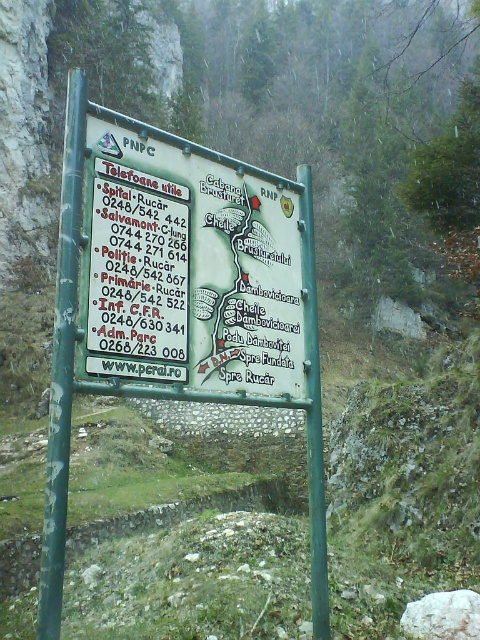
Question: Is green metal sign at center to the left of green metallic pole at center from the viewer's perspective?

Choices:
 (A) yes
 (B) no

Answer: (A)

Question: Which point is farther from the camera taking this photo?

Choices:
 (A) (57, 435)
 (B) (315, 522)

Answer: (B)

Question: Observing the image, what is the correct spatial positioning of green painted metal pole at left in reference to green metallic pole at center?

Choices:
 (A) left
 (B) right

Answer: (A)

Question: Does green metal sign at center appear under green metallic pole at center?

Choices:
 (A) yes
 (B) no

Answer: (B)

Question: Among these points, which one is farthest from the camera?

Choices:
 (A) (303, 252)
 (B) (50, 604)
 (C) (49, 589)

Answer: (A)

Question: Which object appears farthest from the camera in this image?

Choices:
 (A) green metallic pole at center
 (B) green painted metal pole at left
 (C) green metal sign at center

Answer: (A)